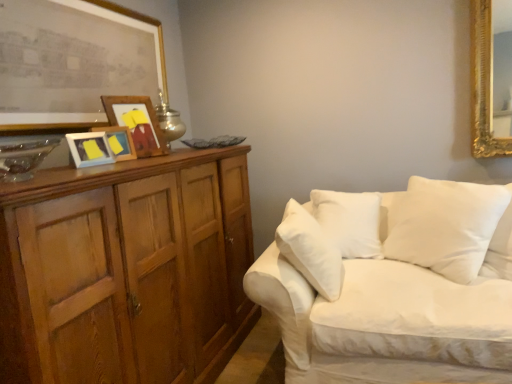
Question: Is white soft cushion at right further to the viewer compared to wooden cabinet at left?

Choices:
 (A) yes
 (B) no

Answer: (A)

Question: Is white soft cushion at right bigger than wooden cabinet at left?

Choices:
 (A) yes
 (B) no

Answer: (B)

Question: From a real-world perspective, is white soft cushion at right beneath wooden cabinet at left?

Choices:
 (A) no
 (B) yes

Answer: (A)

Question: Is white soft cushion at right shorter than wooden cabinet at left?

Choices:
 (A) yes
 (B) no

Answer: (A)

Question: Is white soft cushion at right turned away from wooden cabinet at left?

Choices:
 (A) no
 (B) yes

Answer: (A)

Question: Does white soft cushion at right have a lesser width compared to wooden cabinet at left?

Choices:
 (A) no
 (B) yes

Answer: (B)

Question: Is wooden picture frame at upper left, which is the 4th picture frame in front-to-back order, turned away from white fabric couch at right?

Choices:
 (A) no
 (B) yes

Answer: (A)

Question: Is white fabric couch at right located within wooden picture frame at upper left, which is the 4th picture frame in front-to-back order?

Choices:
 (A) no
 (B) yes

Answer: (A)

Question: From the image's perspective, would you say wooden picture frame at upper left, which appears as the 1th picture frame when viewed from the back, is positioned over white fabric couch at right?

Choices:
 (A) no
 (B) yes

Answer: (B)

Question: Is wooden picture frame at upper left, which is the 4th picture frame in front-to-back order, placed right next to white fabric couch at right?

Choices:
 (A) yes
 (B) no

Answer: (B)

Question: Can you confirm if wooden picture frame at upper left, which appears as the 1th picture frame when viewed from the back, is thinner than white fabric couch at right?

Choices:
 (A) no
 (B) yes

Answer: (B)

Question: From the image's perspective, does wooden picture frame at upper left, which is the 4th picture frame in front-to-back order, appear lower than white fabric couch at right?

Choices:
 (A) yes
 (B) no

Answer: (B)

Question: Considering the relative sizes of wooden picture frame at left, the second picture frame when ordered from front to back, and metallic silver table lamp at upper left in the image provided, is wooden picture frame at left, the second picture frame when ordered from front to back, shorter than metallic silver table lamp at upper left?

Choices:
 (A) yes
 (B) no

Answer: (A)